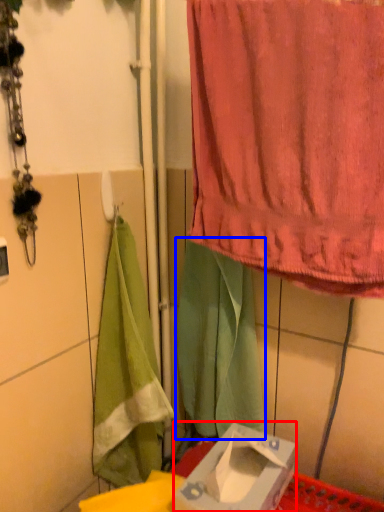
Question: Which point is closer to the camera, box (highlighted by a red box) or cloth (highlighted by a blue box)?

Choices:
 (A) box
 (B) cloth

Answer: (A)